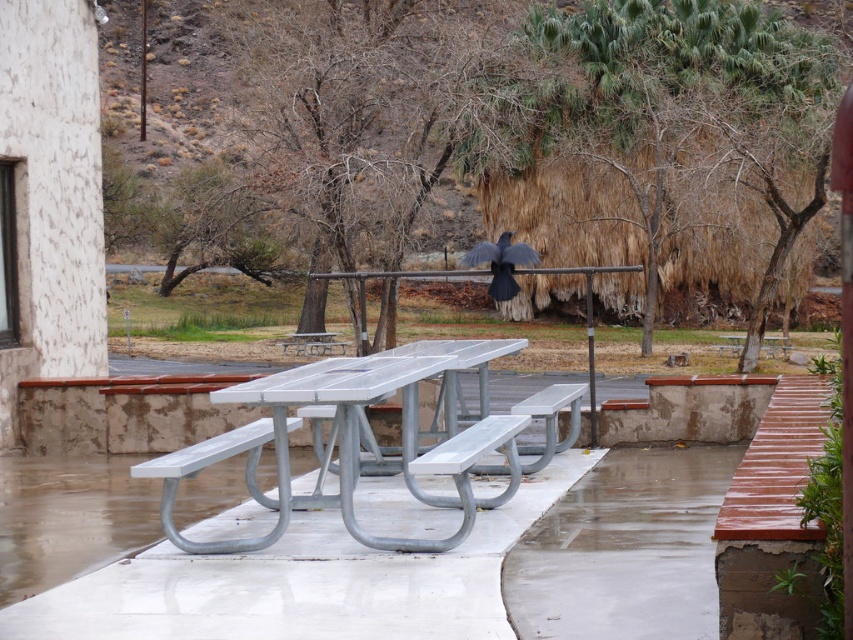
Is metallic silver picnic table at center thinner than metallic silver bench at center?

Incorrect, metallic silver picnic table at center's width is not less than metallic silver bench at center's.

Who is more distant from viewer, [390,540] or [556,445]?

Positioned behind is point [556,445].

The height and width of the screenshot is (640, 853). I want to click on metallic silver picnic table at center, so click(358, 426).